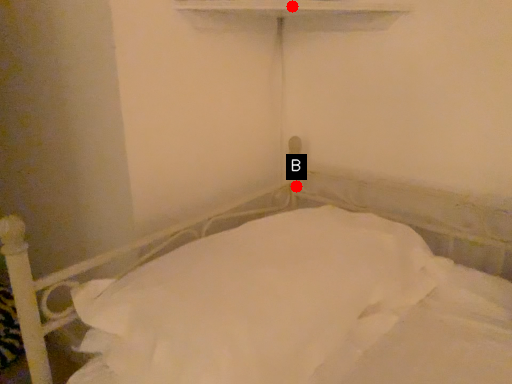
Question: Two points are circled on the image, labeled by A and B beside each circle. Which point is closer to the camera?

Choices:
 (A) A is closer
 (B) B is closer

Answer: (A)